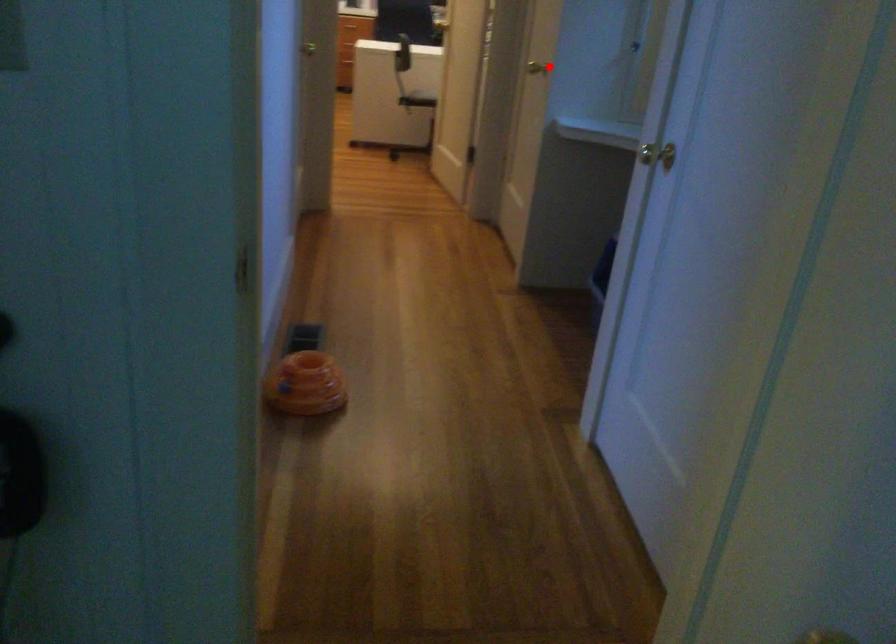
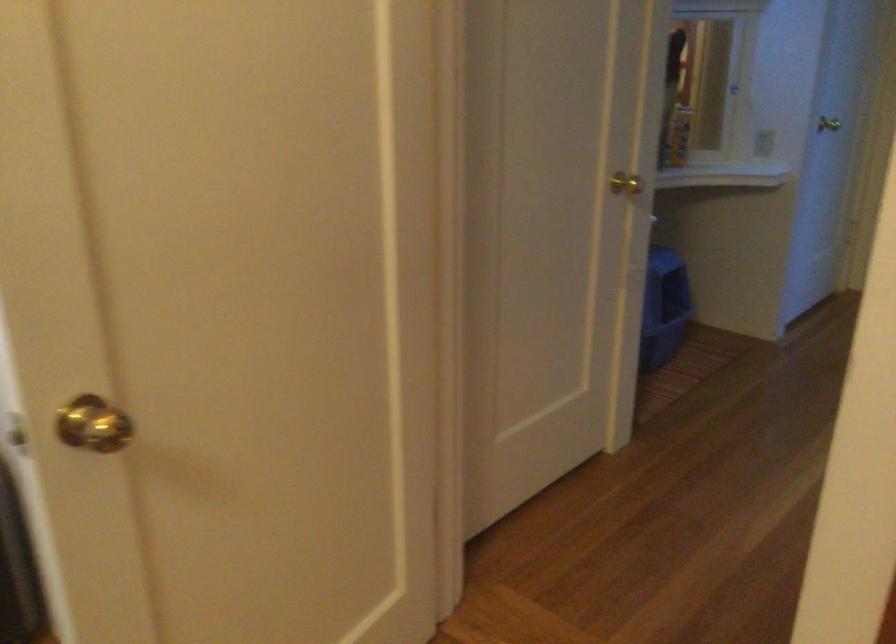
Where in the second image is the point corresponding to the highlighted location from the first image?

(625, 184)